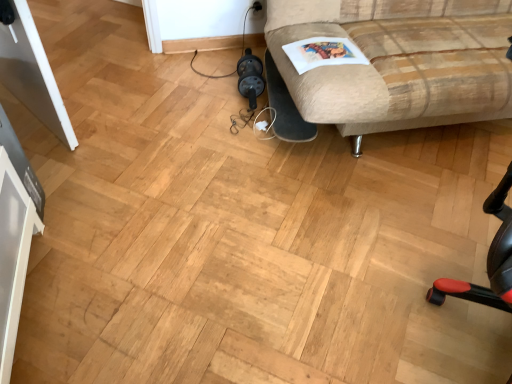
Question: From the image's perspective, is white paper magazine at upper right positioned above or below beige fabric couch at upper right?

Choices:
 (A) above
 (B) below

Answer: (B)

Question: From a real-world perspective, is white paper magazine at upper right above or below beige fabric couch at upper right?

Choices:
 (A) below
 (B) above

Answer: (A)

Question: Would you say white paper magazine at upper right is inside or outside beige fabric couch at upper right?

Choices:
 (A) inside
 (B) outside

Answer: (A)

Question: Is point (296, 36) closer or farther from the camera than point (302, 54)?

Choices:
 (A) closer
 (B) farther

Answer: (B)

Question: Is beige fabric couch at upper right in front of or behind white paper magazine at upper right in the image?

Choices:
 (A) front
 (B) behind

Answer: (A)

Question: In terms of size, does beige fabric couch at upper right appear bigger or smaller than white paper magazine at upper right?

Choices:
 (A) big
 (B) small

Answer: (A)

Question: Is beige fabric couch at upper right inside or outside of white paper magazine at upper right?

Choices:
 (A) outside
 (B) inside

Answer: (A)